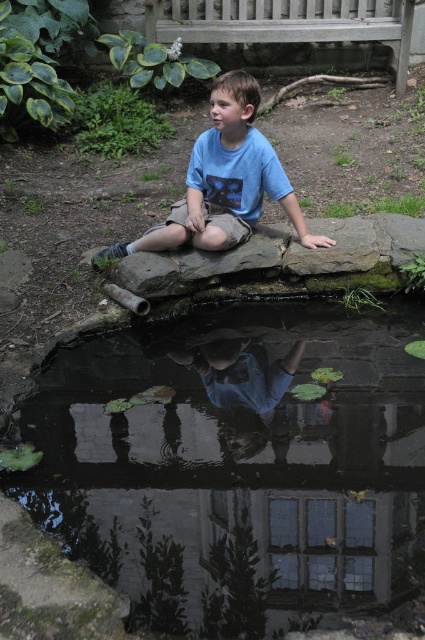
You are a photographer standing at the edge of the pond. You want to take a photo of the blue cotton shirt at center so that it appears centered in the frame. What should you do to ensure the shirt is perfectly centered?

To ensure the blue cotton shirt at center is perfectly centered in your photo, aim your camera so that the shirt aligns with the center point of your viewfinder or screen, which corresponds to the coordinates mentioned in the description.

You are a painter standing at the edge of the pond. You want to paint the transparent water at center and the wooden bench at upper center. Which object will appear larger in your painting if you paint them to scale?

The transparent water at center will appear larger in the painting because it is much taller than the wooden bench at upper center.